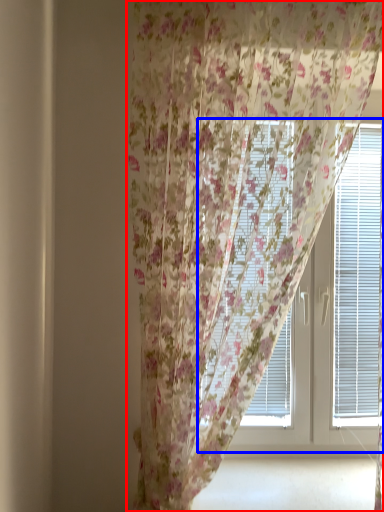
Question: Among these objects, which one is nearest to the camera, curtain (highlighted by a red box) or bay window (highlighted by a blue box)?

Choices:
 (A) curtain
 (B) bay window

Answer: (A)